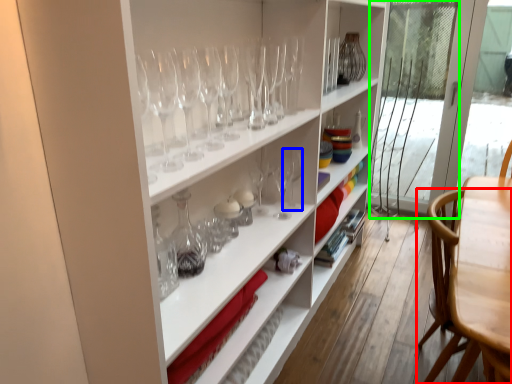
Question: Which object is positioned farthest from chair (highlighted by a red box)? Select from wine glass (highlighted by a blue box) and screen door (highlighted by a green box).

Choices:
 (A) wine glass
 (B) screen door

Answer: (B)